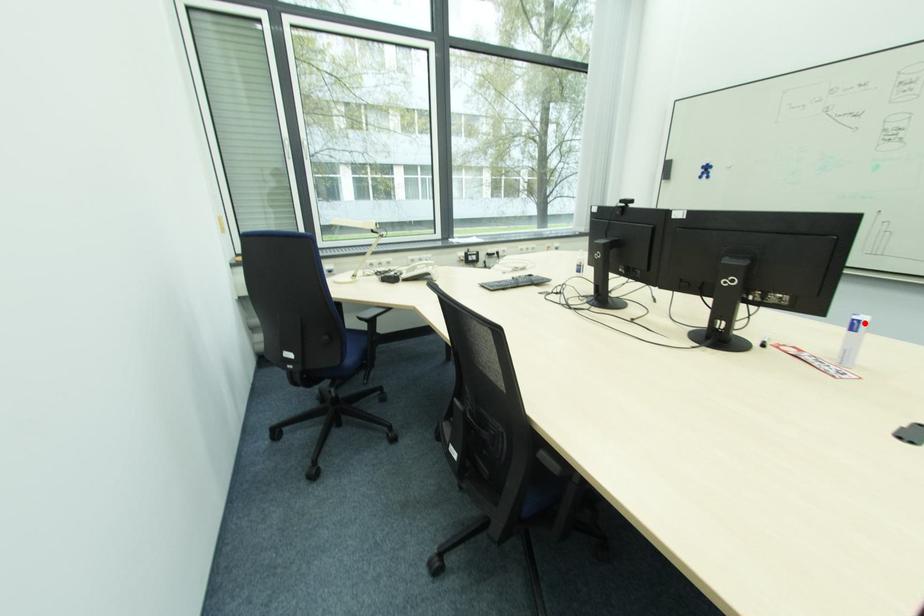
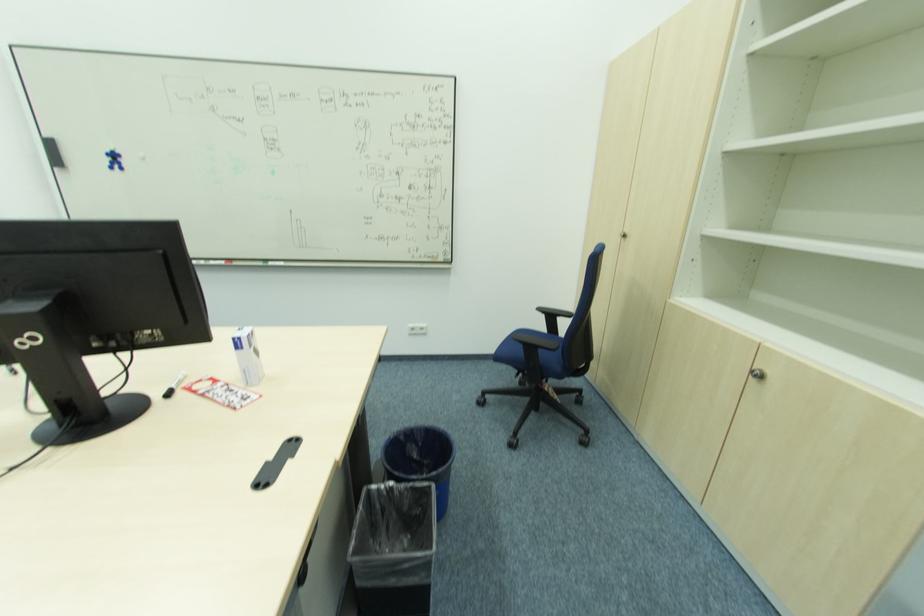
Find the pixel in the second image that matches the highlighted location in the first image.

(244, 339)